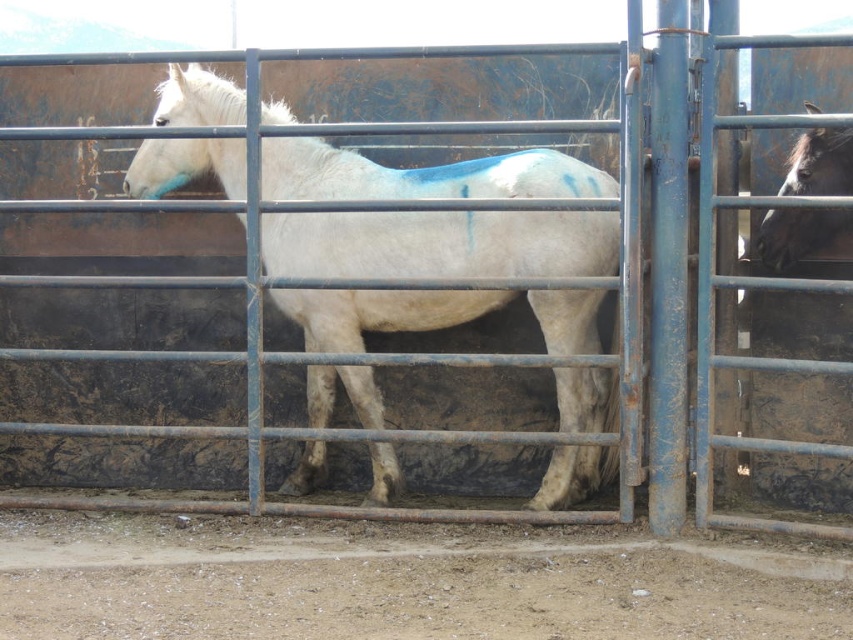
You are a farmer checking the stables. You notice the white matte horse at center and the black glossy horse at right. Which horse do you think is taller?

The white matte horse at center is taller than the black glossy horse at right.

You are a farmer who wants to ensure both horses have enough space to move comfortably. Given that the white matte horse at center is wider than the black glossy horse at right, which horse requires a larger stall area?

The white matte horse at center requires a larger stall area because its width surpasses that of the black glossy horse at right.